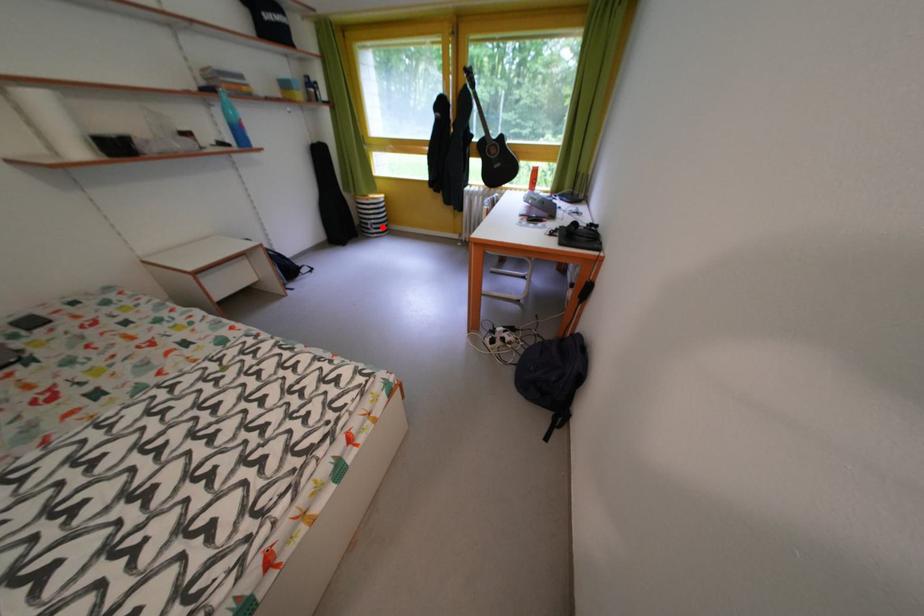
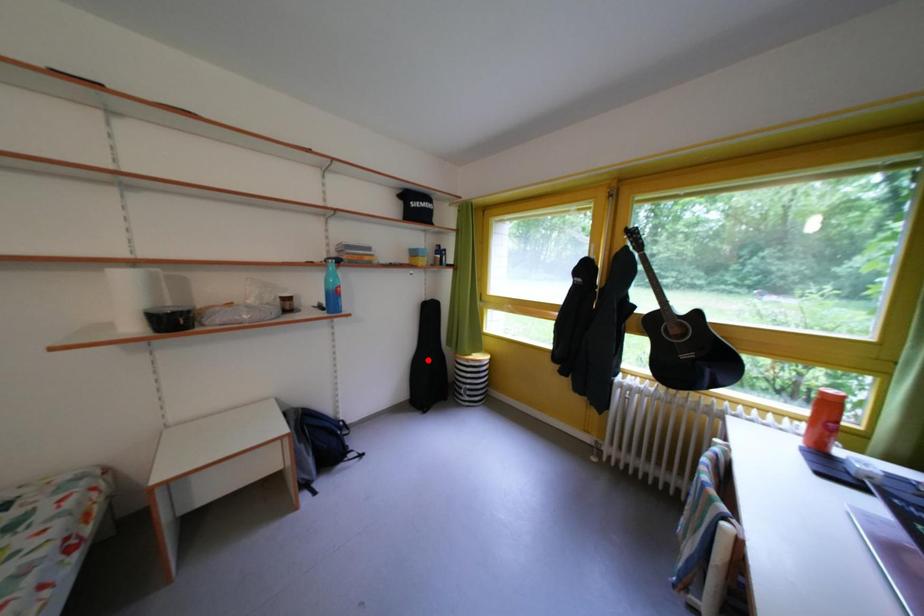
I am providing you with two images of the same scene from different viewpoints. A red point is marked on the first image and another point is marked on the second image. Is the red point in image1 aligned with the point shown in image2?

No